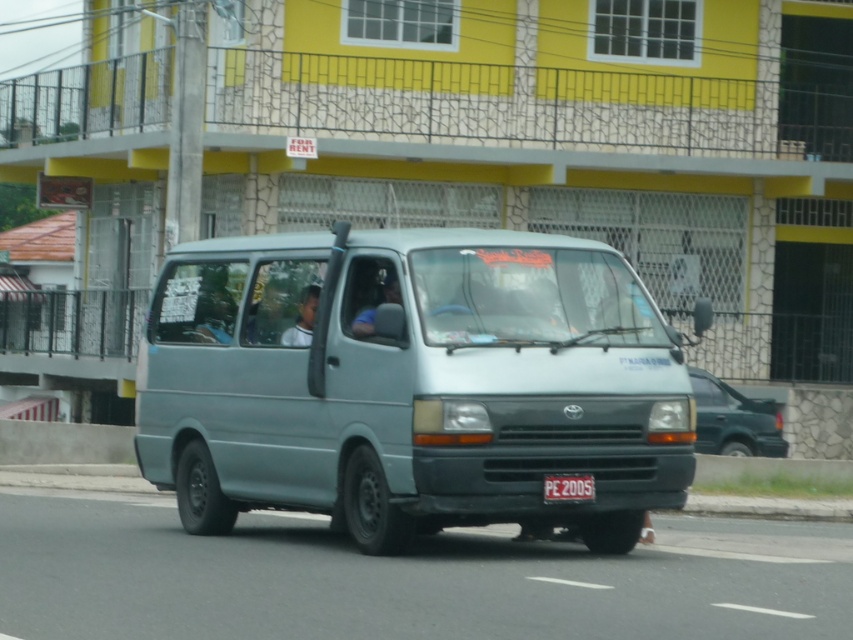
Consider the image. You are a driver passing by a van and a building. You notice the white plastic license plate at center and the matte blue shirt at center. Which object is smaller in size?

The white plastic license plate at center is smaller than the matte blue shirt at center.

Looking at this image, you are a delivery driver who needs to park your vehicle in a parking spot that can only accommodate vehicles up to the height of the green matte suv at right. You are driving the light blue matte van at center. Can you safely park your van in this spot without exceeding the height limit?

The light blue matte van at center is taller than the green matte suv at right. Therefore, parking the light blue matte van at center in the spot designated for vehicles up to the height of the green matte suv at right would exceed the height limit, making it unsafe to park there.